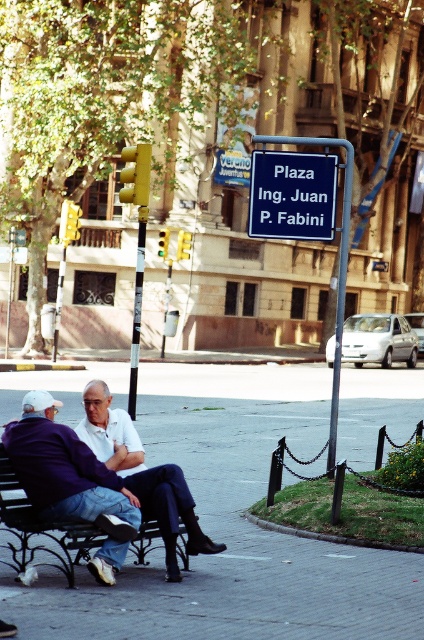
In the scene shown: Which is more to the right, gray concrete pavement at center or blue plastic sign at center?

Result: blue plastic sign at center

Which of these two, gray concrete pavement at center or blue plastic sign at center, stands taller?

With more height is blue plastic sign at center.

Which is in front, point (376, 582) or point (326, 163)?

Positioned in front is point (376, 582).

The image size is (424, 640). I want to click on gray concrete pavement at center, so click(231, 529).

Does white matte shirt at center lie behind black wrought iron bench at center?

Yes.

Is white matte shirt at center to the left of black wrought iron bench at center from the viewer's perspective?

Incorrect, white matte shirt at center is not on the left side of black wrought iron bench at center.

This screenshot has width=424, height=640. What do you see at coordinates (142, 474) in the screenshot?
I see `white matte shirt at center` at bounding box center [142, 474].

This screenshot has width=424, height=640. Identify the location of white matte shirt at center. (142, 474).

Is blue plastic sign at center in front of black wrought iron bench at center?

That is False.

This screenshot has height=640, width=424. What are the coordinates of `blue plastic sign at center` in the screenshot? It's located at (292, 195).

At what (x,y) coordinates should I click in order to perform the action: click on blue plastic sign at center. Please return your answer as a coordinate pair (x, y). The image size is (424, 640). Looking at the image, I should click on (292, 195).